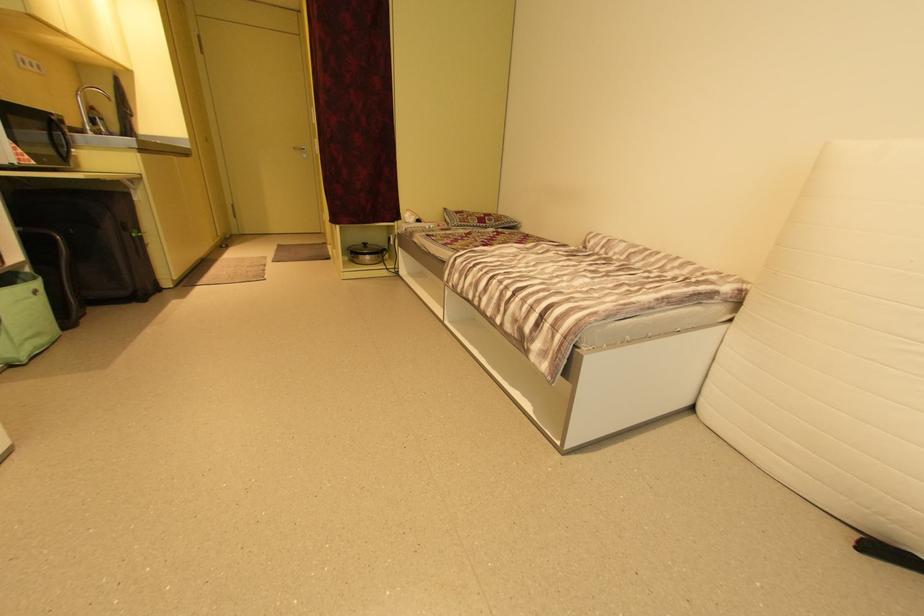
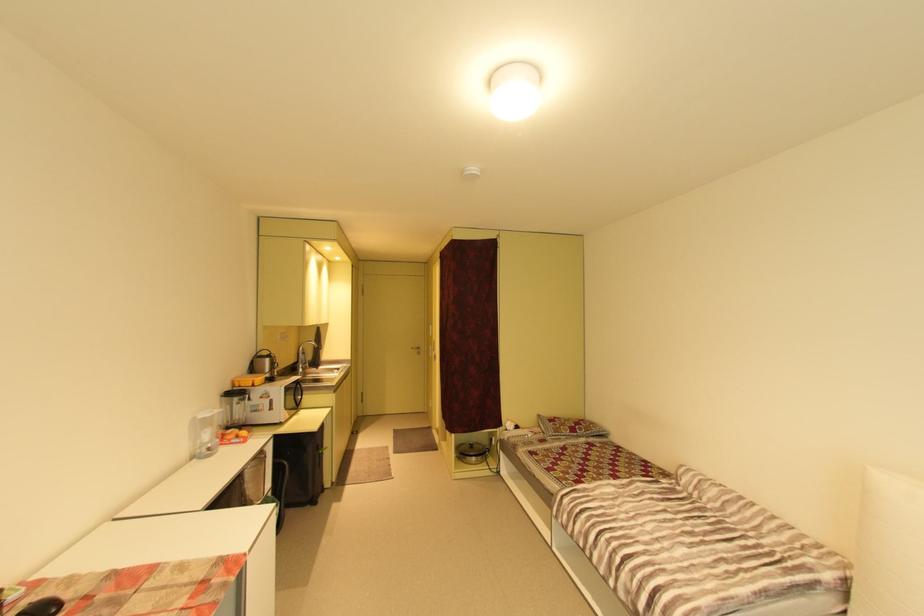
Find the pixel in the second image that matches point 122,129 in the first image.

(317, 358)